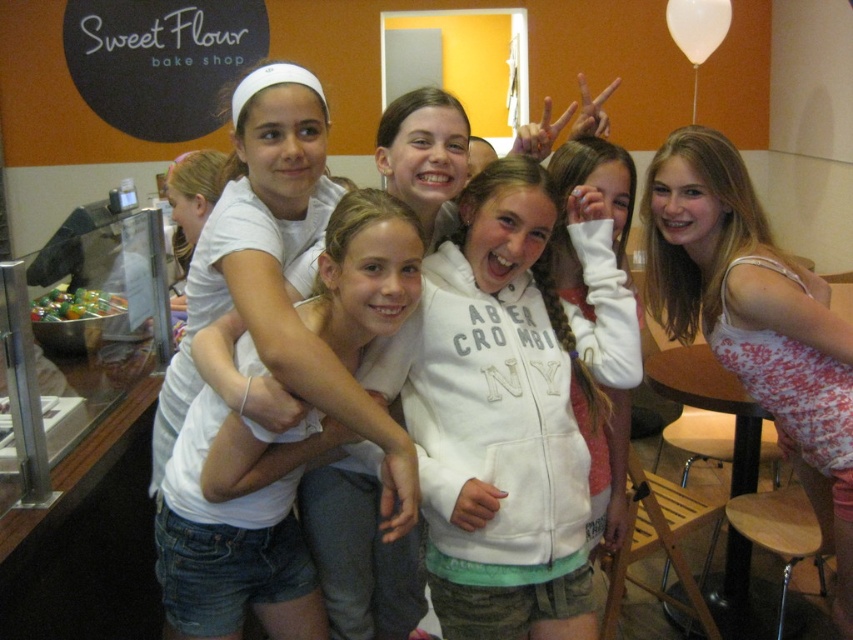
You are a photographer trying to capture a closeup shot of the pink floral tank top at right and the jeans at center. Since you want to ensure both items are clearly visible, which one should you zoom in on more?

The pink floral tank top at right is larger in size than the jeans at center, so you should zoom in more on the jeans at center to ensure both are clearly visible.

You are a photographer trying to capture a closeup of the pink floral tank top at right and the jeans at center. Which one should you focus on first to ensure it appears sharp in the photo?

The pink floral tank top at right is closer to the viewer than the jeans at center, so you should focus on the pink floral tank top at right first to ensure it appears sharp in the photo.